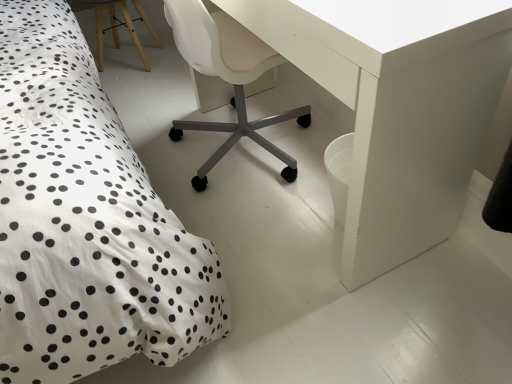
Where is `free spot in front of white plastic chair at center`? This screenshot has width=512, height=384. free spot in front of white plastic chair at center is located at coordinates (268, 250).